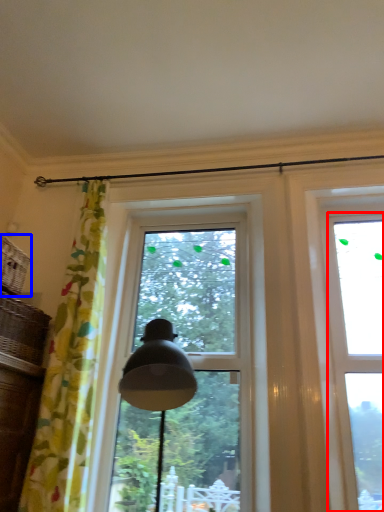
Question: Which of the following is the farthest to the observer, window (highlighted by a red box) or basket (highlighted by a blue box)?

Choices:
 (A) window
 (B) basket

Answer: (A)